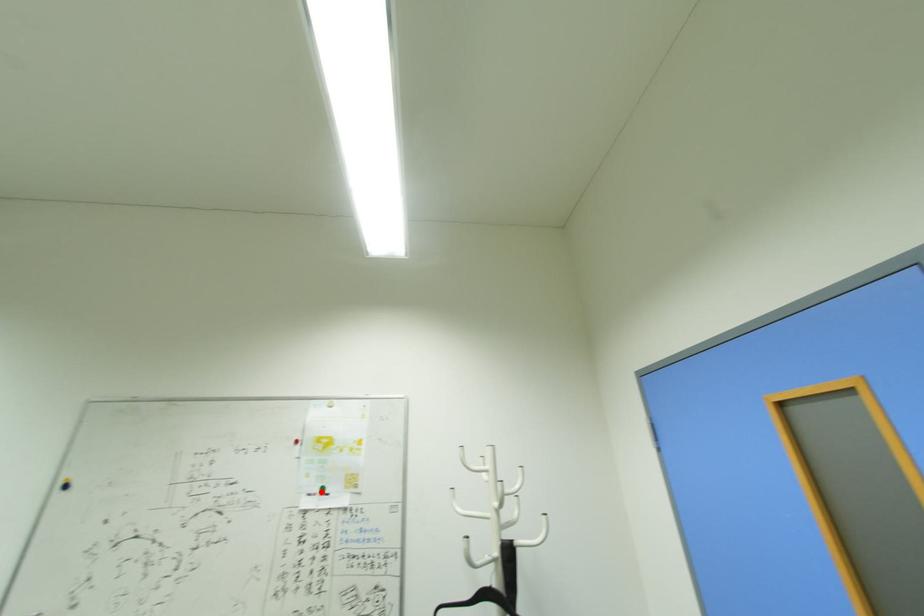
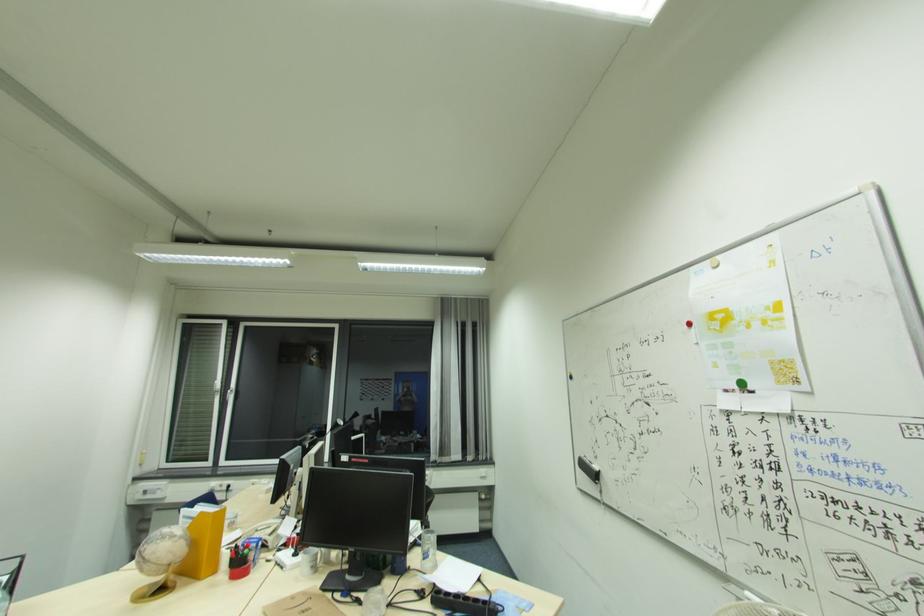
Find the pixel in the second image that matches the highlighted location in the first image.

(739, 387)